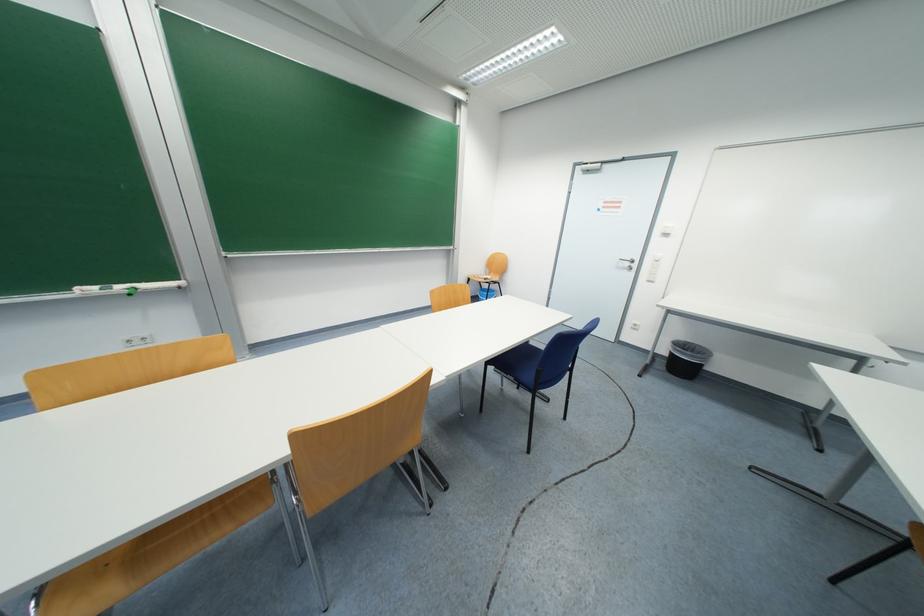
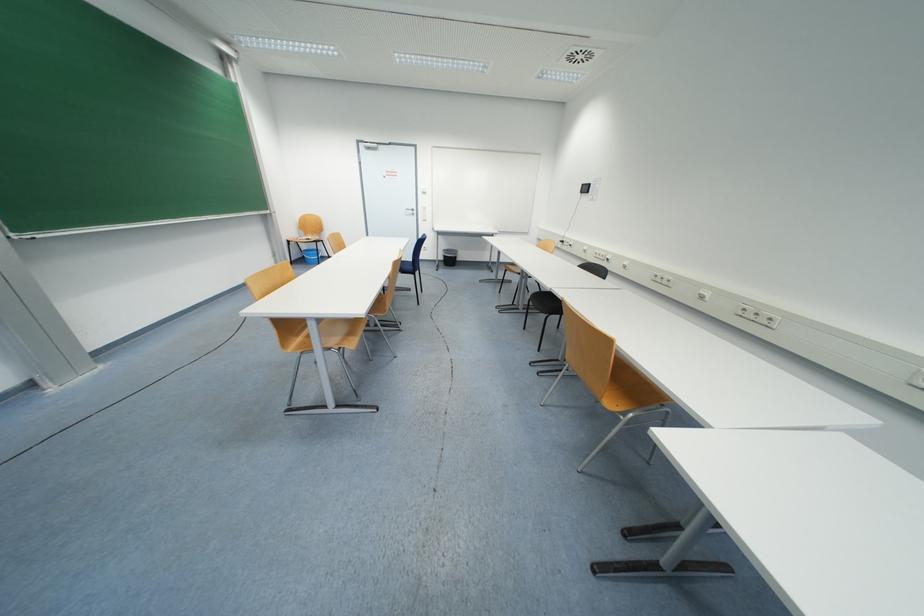
Where in the second image is the point corresponding to (676,355) from the first image?

(448, 257)